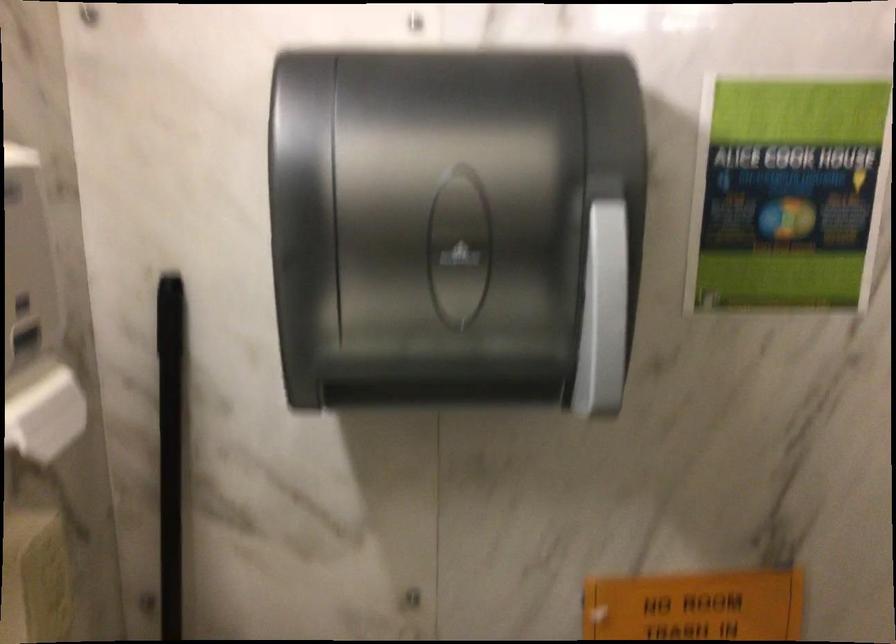
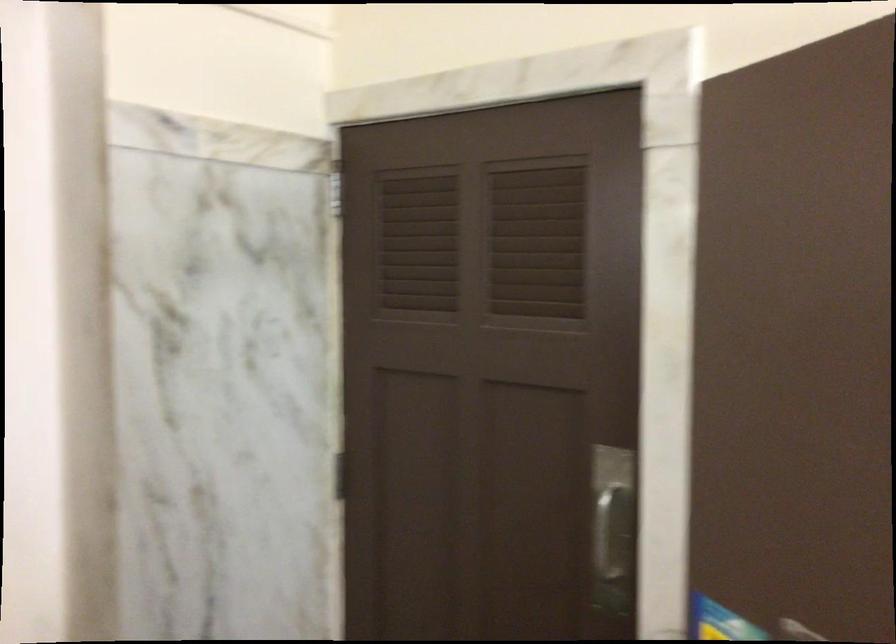
Question: The camera is either moving clockwise (left) or counter-clockwise (right) around the object. The first image is from the beginning of the video and the second image is from the end. Is the camera moving left or right when shooting the video?

Choices:
 (A) Left
 (B) Right

Answer: (A)